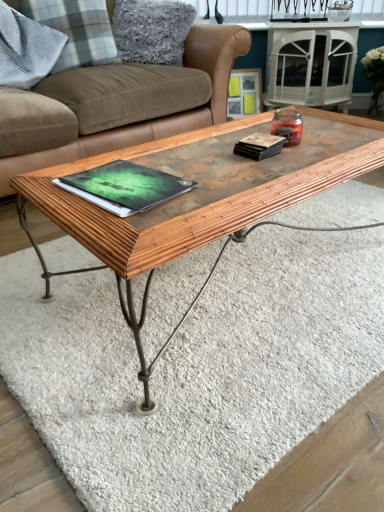
In order to click on vacant point above wooden textured coffee table at center (from a real-world perspective) in this screenshot , I will do `click(253, 157)`.